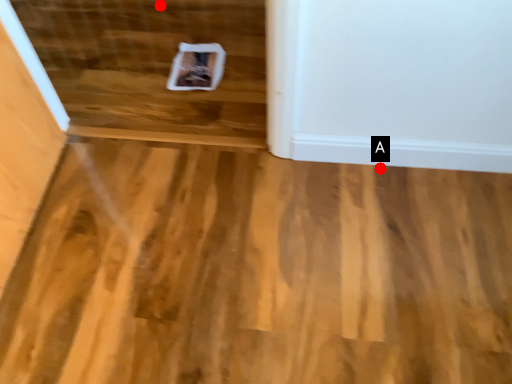
Question: Two points are circled on the image, labeled by A and B beside each circle. Which of the following is the farthest from the observer?

Choices:
 (A) A is further
 (B) B is further

Answer: (B)